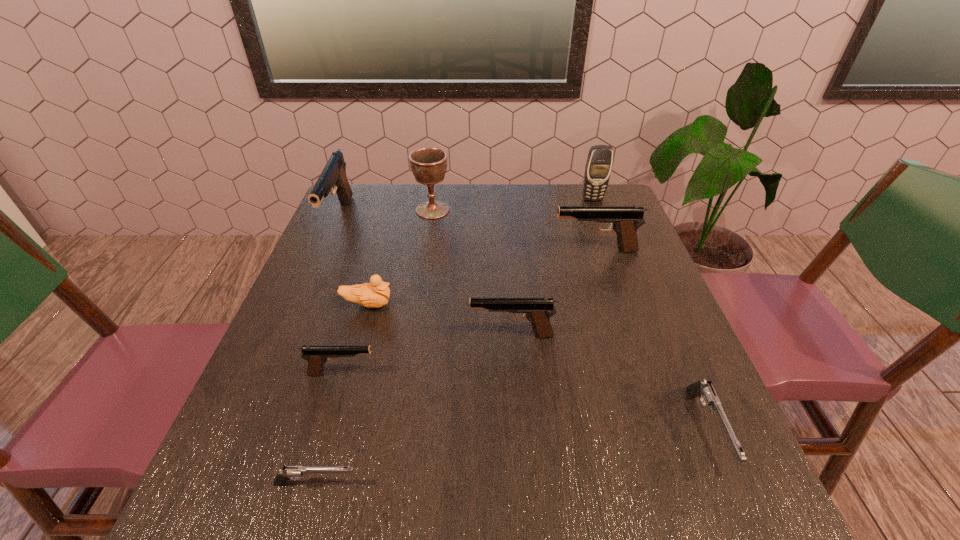
In order to click on vacant space that is in between the cellular telephone and the second tallest pistol in this screenshot , I will do `click(594, 225)`.

Locate an element on the screen. Image resolution: width=960 pixels, height=540 pixels. vacant point located between the nearest black pistol and the bigger silver pistol is located at coordinates (525, 401).

You are a GUI agent. You are given a task and a screenshot of the screen. Output one action in this format:
    pyautogui.click(x=<x>, y=<y>)
    Task: Click on the vacant area that lies between the smallest black pistol and the leftmost black pistol
    The image size is (960, 540).
    Given the screenshot: What is the action you would take?
    pyautogui.click(x=341, y=296)

Where is `unoccupied position between the nearest black pistol and the fifth shortest object`? The width and height of the screenshot is (960, 540). unoccupied position between the nearest black pistol and the fifth shortest object is located at coordinates (427, 354).

Find the location of a particular element. The image size is (960, 540). vacant space that's between the fourth nearest object and the brown chalice is located at coordinates (472, 273).

Identify the location of free area in between the fifth farthest object and the second black pistol from right to left. Image resolution: width=960 pixels, height=540 pixels. (440, 320).

You are a GUI agent. You are given a task and a screenshot of the screen. Output one action in this format:
    pyautogui.click(x=<x>, y=<y>)
    Task: Click on the object that stands as the third closest to the fifth shortest object
    This screenshot has width=960, height=540.
    Given the screenshot: What is the action you would take?
    pyautogui.click(x=706, y=392)

Locate which object ranks second in proximity to the duckling. Please provide its 2D coordinates. Your answer should be formatted as a tuple, i.e. [(x, y)], where the tuple contains the x and y coordinates of a point satisfying the conditions above.

[(537, 310)]

Point out which pistol is positioned as the nearest to the brown chalice. Please provide its 2D coordinates. Your answer should be formatted as a tuple, i.e. [(x, y)], where the tuple contains the x and y coordinates of a point satisfying the conditions above.

[(333, 175)]

Identify the location of pistol that is the second nearest to the smaller silver pistol. (537, 310).